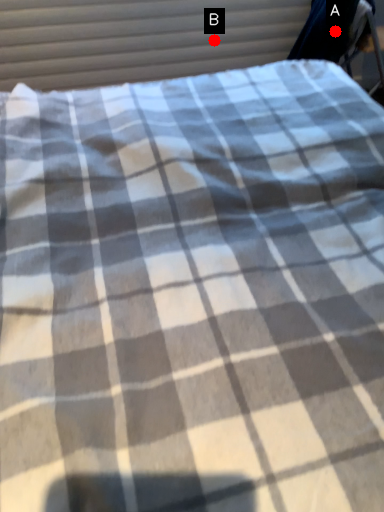
Question: Two points are circled on the image, labeled by A and B beside each circle. Which point is further to the camera?

Choices:
 (A) A is further
 (B) B is further

Answer: (B)